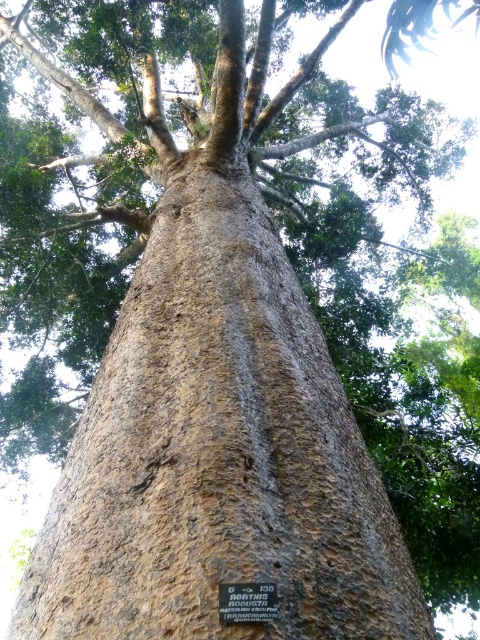
Question: Does brown rough bark at center appear on the right side of metallic plaque at center?

Choices:
 (A) no
 (B) yes

Answer: (A)

Question: Can you confirm if brown rough bark at center is bigger than metallic plaque at center?

Choices:
 (A) yes
 (B) no

Answer: (A)

Question: Does brown rough bark at center have a lesser width compared to metallic plaque at center?

Choices:
 (A) yes
 (B) no

Answer: (B)

Question: Which object is farther from the camera taking this photo?

Choices:
 (A) brown rough bark at center
 (B) metallic plaque at center

Answer: (B)